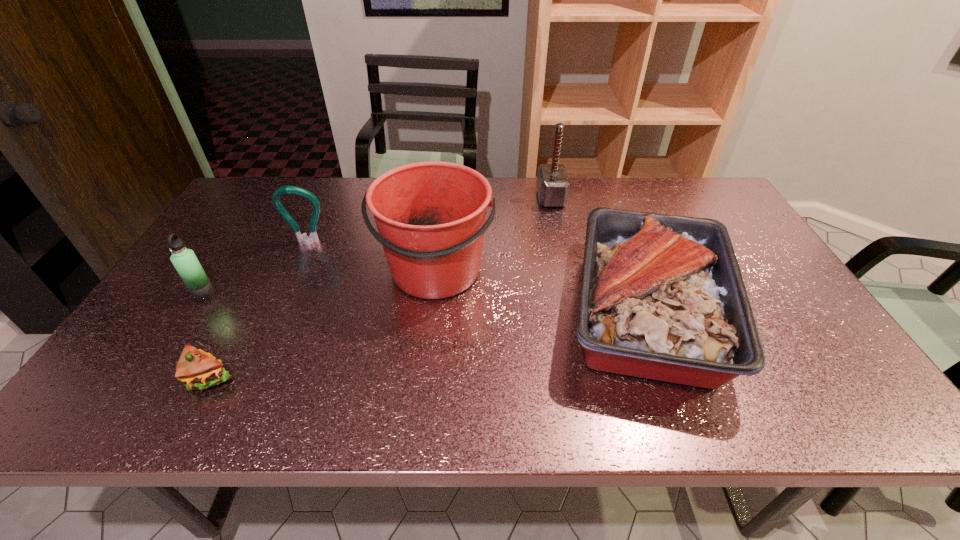
Identify which object is the nearest to the fourth object from left to right. Please provide its 2D coordinates. Your answer should be formatted as a tuple, i.e. [(x, y)], where the tuple contains the x and y coordinates of a point satisfying the conditions above.

[(313, 237)]

The image size is (960, 540). What are the coordinates of `vacant region that satisfies the following two spatial constraints: 1. at the jaws of the bucket; 2. on the left side of the bottle opener` in the screenshot? It's located at (295, 271).

The width and height of the screenshot is (960, 540). I want to click on free space that satisfies the following two spatial constraints: 1. on the back side of the shortest object; 2. on the right side of the farthest object, so tap(304, 198).

Locate an element on the screen. The image size is (960, 540). free point that satisfies the following two spatial constraints: 1. on the back side of the hammer; 2. on the left side of the bucket is located at coordinates (444, 198).